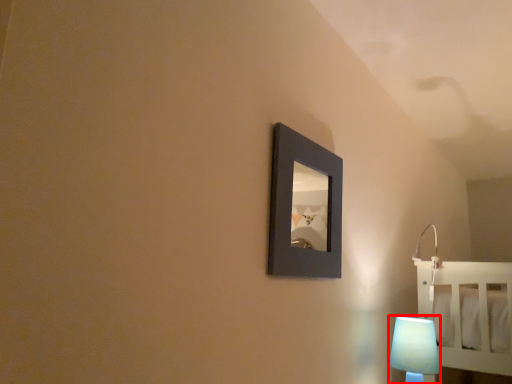
Question: Considering the relative positions of lamp (annotated by the red box) and picture frame in the image provided, where is lamp (annotated by the red box) located with respect to the staircase?

Choices:
 (A) right
 (B) left

Answer: (A)